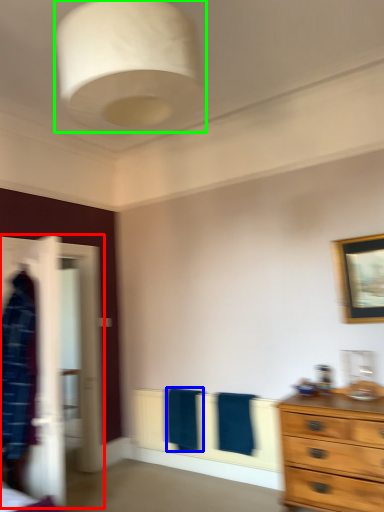
Question: Which object is the farthest from closet (highlighted by a red box)? Choose among these: bath towel (highlighted by a blue box) or light fixture (highlighted by a green box).

Choices:
 (A) bath towel
 (B) light fixture

Answer: (B)